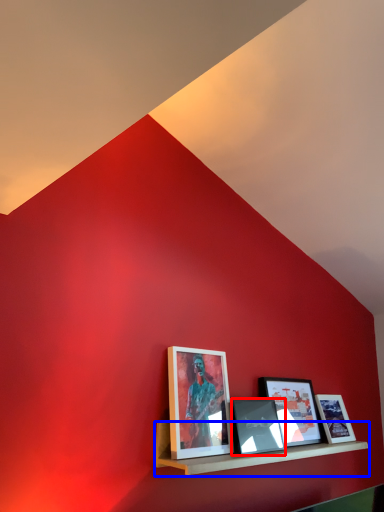
Question: Among these objects, which one is nearest to the camera, picture frame (highlighted by a red box) or shelf (highlighted by a blue box)?

Choices:
 (A) picture frame
 (B) shelf

Answer: (B)